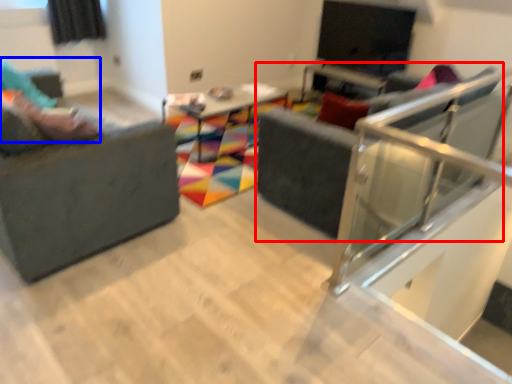
Question: Which of the following is the farthest to the observer, swivel chair (highlighted by a red box) or person (highlighted by a blue box)?

Choices:
 (A) swivel chair
 (B) person

Answer: (B)